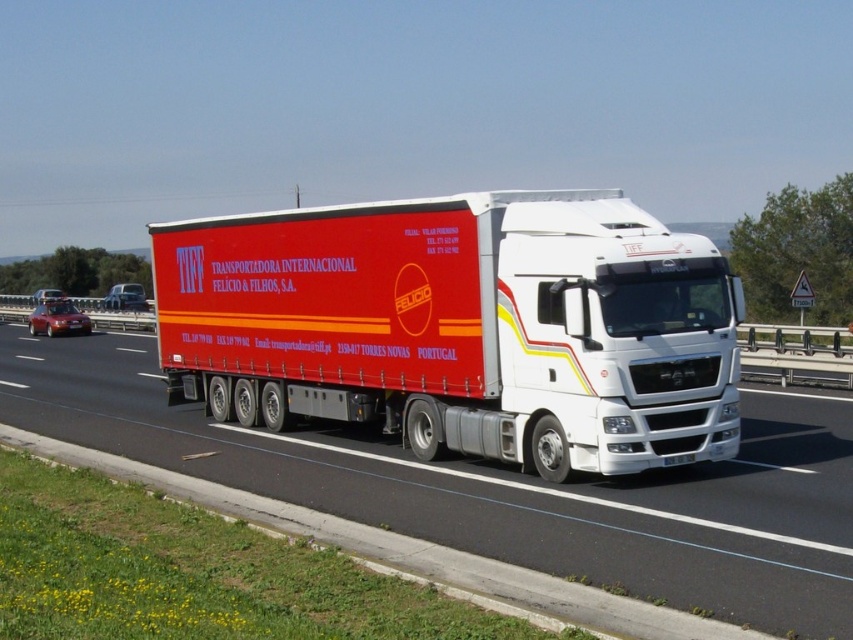
You are a traffic officer monitoring a highway. You need to determine the exact location of the white matte trailer truck at center. What are its coordinates?

The white matte trailer truck at center is located at coordinates point (461, 326).

You are a traffic officer observing a highway scene. You notice a white matte trailer truck at center and a red matte truck at center. Which truck is positioned higher in the image?

The white matte trailer truck at center is positioned higher than the red matte truck at center in the image.

You are a delivery driver operating a truck that is 1.5 meters wide. You are on a highway and need to pass through a narrow tunnel that only allows vehicles up to 1.7 meters in width. There is a white matte trailer truck at center and a red matte truck at center in front of you. Can you safely pass through the tunnel while maintaining a safe distance of at least 1.8 meters between your truck and the trucks ahead?

The distance between the white matte trailer truck at center and red matte truck at center is 1.85 meters, which is slightly more than the required 1.8 meters. However, your truck is 1.5 meters wide, and the tunnel allows up to 1.7 meters. Since your truck is within the width limit, you can safely pass through the tunnel while maintaining the required distance.